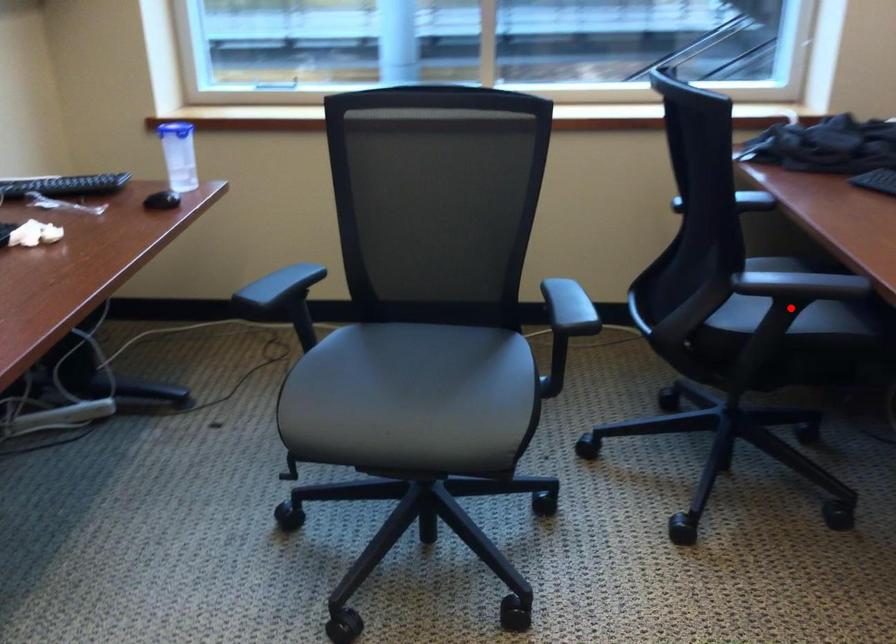
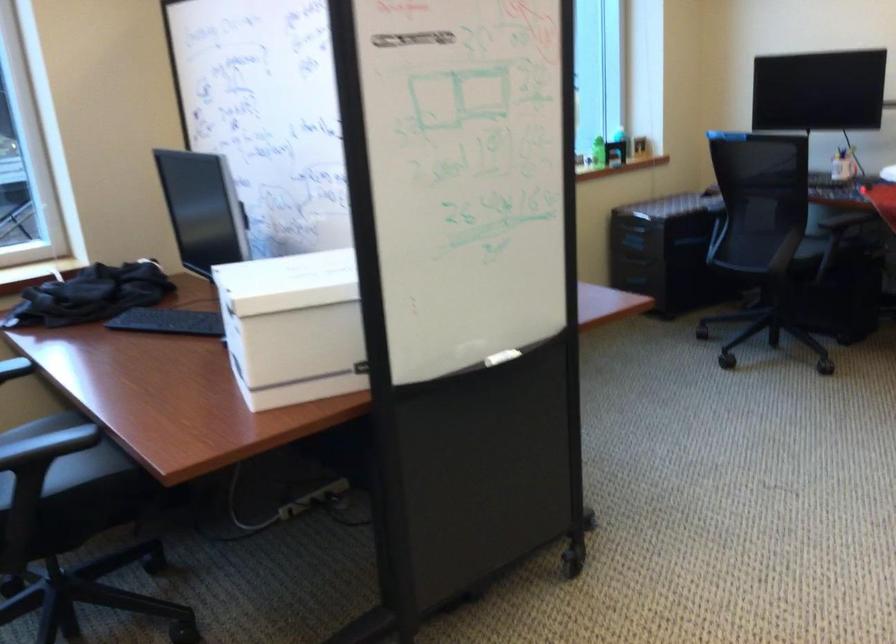
Question: I am providing you with two images of the same scene from different viewpoints. Image1 has a red point marked. In image2, the corresponding 3D location appears at what relative position? Reply with the corresponding letter.

Choices:
 (A) Closer
 (B) Farther

Answer: (B)